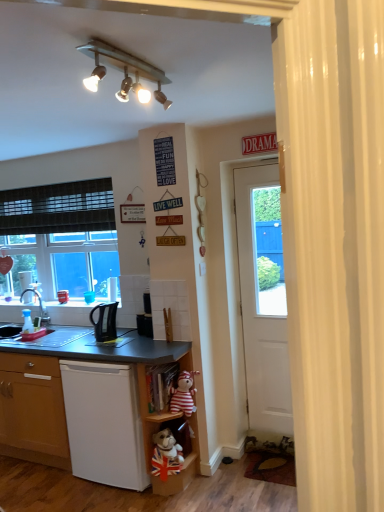
The height and width of the screenshot is (512, 384). I want to click on vacant space situated above brown textured rug at lower right (from a real-world perspective), so click(x=276, y=464).